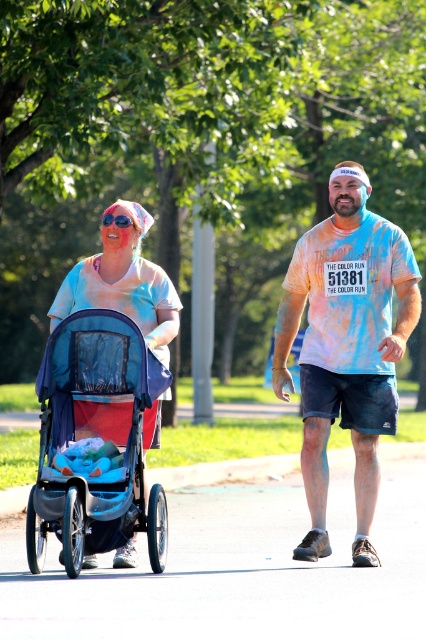
You are a participant in The Color Run and you see two points marked in the image. The first point is at coordinate point (224, 580) and the second is at point (118, 328). Which point is closer to you as you stand at the starting line?

Point (224, 580) is in front of point (118, 328), so the first point is closer to you.